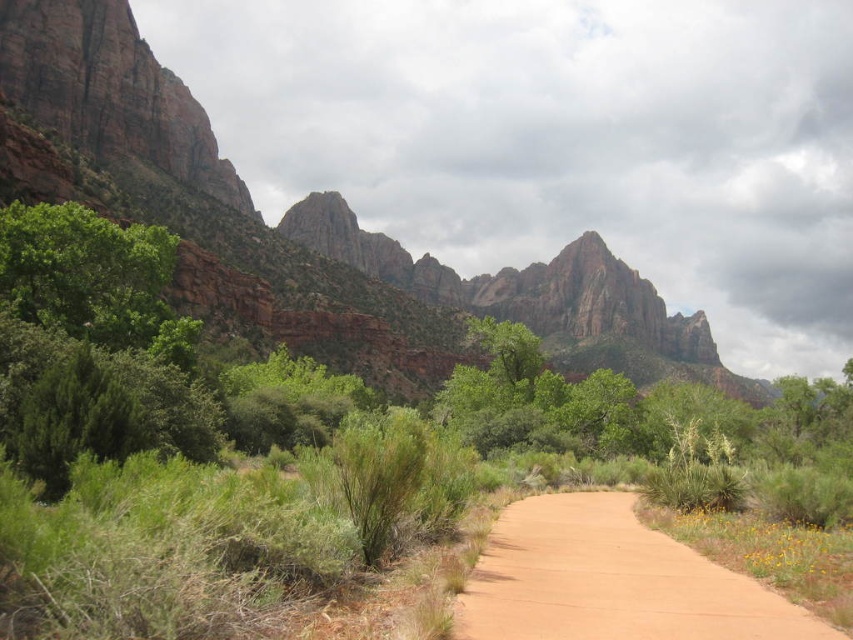
Question: Does green leafy shrubs at center have a lesser width compared to sandy dirt path at center?

Choices:
 (A) yes
 (B) no

Answer: (B)

Question: Is rustic rock formation at upper center to the left of sandy dirt path at center from the viewer's perspective?

Choices:
 (A) yes
 (B) no

Answer: (B)

Question: Can you confirm if green leafy shrubs at center is smaller than sandy dirt path at center?

Choices:
 (A) no
 (B) yes

Answer: (A)

Question: Which point is closer to the camera?

Choices:
 (A) (53, 68)
 (B) (555, 500)
 (C) (293, 541)

Answer: (C)

Question: Which point is closer to the camera?

Choices:
 (A) green leafy shrubs at center
 (B) rustic rock formation at upper center
 (C) sandy dirt path at center

Answer: (A)

Question: Which of these objects is positioned closest to the green leafy shrubs at center?

Choices:
 (A) rustic rock formation at upper center
 (B) sandy dirt path at center

Answer: (B)